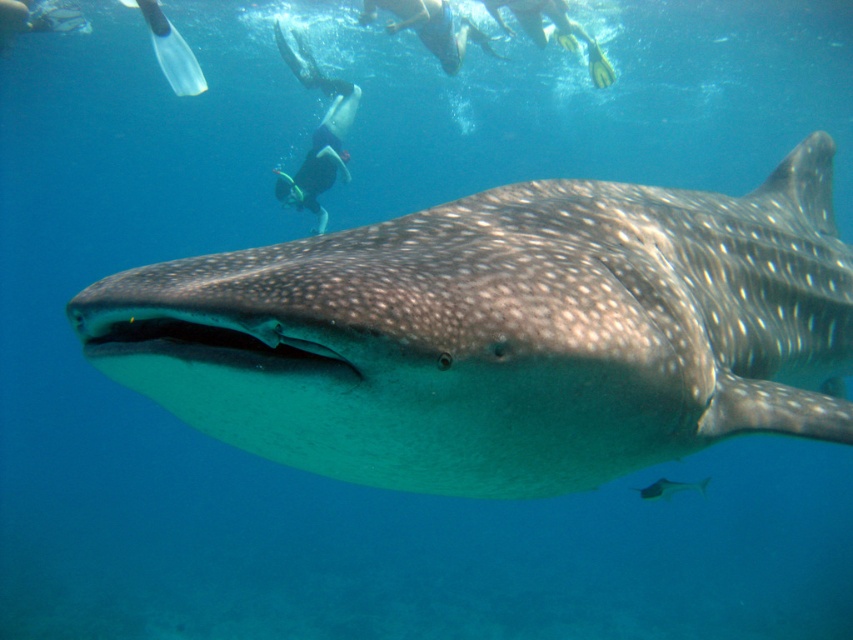
You are a snorkeler wearing a black wetsuit at upper center. You want to swim closer to the speckled skin shark at center to take a photo. If your swimming speed is 1.2 meters per second, how many seconds will it take you to reach the shark?

The distance between the speckled skin shark at center and the black wetsuit at upper center is 5.60 meters. At a swimming speed of 1.2 meters per second, it would take approximately 4.67 seconds to reach the shark.

You are a diver underwater and want to reach the point closer to you. Which point should you swim towards, point (372,8) or point (654,493)?

Point (372,8) is closer to you than point (654,493), so you should swim towards point (372,8).

In the scene shown: You are a diver observing the whale shark and notice two points marked in the image. Which point, point (331,276) or point (367,0), is closer to you?

Point (331,276) is closer to the viewer than point (367,0).